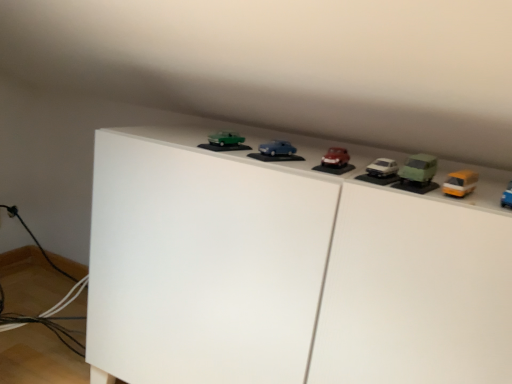
At what (x,y) coordinates should I click in order to perform the action: click on matte blue car at center, the 2th toy from the left. Please return your answer as a coordinate pair (x, y). This screenshot has height=384, width=512. Looking at the image, I should click on (276, 152).

This screenshot has width=512, height=384. What do you see at coordinates (289, 269) in the screenshot? I see `white matte cabinet at upper center` at bounding box center [289, 269].

Describe the element at coordinates (418, 174) in the screenshot. I see `green matte car at right, marked as the 4th toy in a left-to-right arrangement` at that location.

Locate an element on the screen. matte red car at center, marked as the 3th toy in a right-to-left arrangement is located at coordinates (335, 162).

Consider the image. In order to face green matte car at upper center, the fifth toy positioned from the right, should I rotate leftwards or rightwards?

Turn left by 4.174 degrees to look at green matte car at upper center, the fifth toy positioned from the right.

At what (x,y) coordinates should I click in order to perform the action: click on yellow matte van at upper right, the first toy from the right. Please return your answer as a coordinate pair (x, y). Looking at the image, I should click on (460, 183).

How many degrees apart are the facing directions of matte blue car at center, which is the 4th toy in right-to-left order, and white matte cabinet at upper center?

23.6 degrees separate the facing orientations of matte blue car at center, which is the 4th toy in right-to-left order, and white matte cabinet at upper center.

Considering the sizes of objects matte blue car at center, which is the 4th toy in right-to-left order, and white matte cabinet at upper center in the image provided, who is shorter, matte blue car at center, which is the 4th toy in right-to-left order, or white matte cabinet at upper center?

Standing shorter between the two is matte blue car at center, which is the 4th toy in right-to-left order.

Is matte blue car at center, the 2th toy from the left, next to white matte cabinet at upper center and touching it?

No.

Which is more to the right, matte blue car at center, which is the 4th toy in right-to-left order, or white matte cabinet at upper center?

From the viewer's perspective, white matte cabinet at upper center appears more on the right side.

Is yellow matte van at upper right, the fifth toy viewed from the left, smaller than green matte car at right, placed as the second toy when sorted from right to left?

Indeed, yellow matte van at upper right, the fifth toy viewed from the left, has a smaller size compared to green matte car at right, placed as the second toy when sorted from right to left.

How different are the orientations of yellow matte van at upper right, the fifth toy viewed from the left, and green matte car at right, marked as the 4th toy in a left-to-right arrangement, in degrees?

The angle between the facing direction of yellow matte van at upper right, the fifth toy viewed from the left, and the facing direction of green matte car at right, marked as the 4th toy in a left-to-right arrangement, is 1.58 degrees.

From the picture: From a real-world perspective, is yellow matte van at upper right, the fifth toy viewed from the left, above or below green matte car at right, marked as the 4th toy in a left-to-right arrangement?

yellow matte van at upper right, the fifth toy viewed from the left, is situated lower than green matte car at right, marked as the 4th toy in a left-to-right arrangement, in the real world.

The height and width of the screenshot is (384, 512). In order to click on the 1st toy behind the yellow matte van at upper right, the first toy from the right in this screenshot , I will do `click(418, 174)`.

Which is more distant, (x=477, y=250) or (x=425, y=191)?

The point (x=425, y=191) is more distant.

From the image's perspective, is white matte cabinet at upper center under green matte car at right, placed as the second toy when sorted from right to left?

Yes.

From the picture: Between white matte cabinet at upper center and green matte car at right, placed as the second toy when sorted from right to left, which one has larger width?

white matte cabinet at upper center is wider.

From a real-world perspective, is white matte cabinet at upper center above or below green matte car at upper center, which ranks as the 1th toy in left-to-right order?

From a real-world perspective, white matte cabinet at upper center is physically below green matte car at upper center, which ranks as the 1th toy in left-to-right order.

Is white matte cabinet at upper center aimed at green matte car at upper center, which ranks as the 1th toy in left-to-right order?

No, white matte cabinet at upper center is not facing towards green matte car at upper center, which ranks as the 1th toy in left-to-right order.

Between white matte cabinet at upper center and green matte car at upper center, the fifth toy positioned from the right, which one has smaller size?

With smaller size is green matte car at upper center, the fifth toy positioned from the right.

In terms of width, does green matte car at right, marked as the 4th toy in a left-to-right arrangement, look wider or thinner when compared to yellow matte van at upper right, the fifth toy viewed from the left?

In the image, green matte car at right, marked as the 4th toy in a left-to-right arrangement, appears to be more narrow than yellow matte van at upper right, the fifth toy viewed from the left.

Is green matte car at right, placed as the second toy when sorted from right to left, situated inside yellow matte van at upper right, the first toy from the right, or outside?

green matte car at right, placed as the second toy when sorted from right to left, is not enclosed by yellow matte van at upper right, the first toy from the right.

Is green matte car at right, marked as the 4th toy in a left-to-right arrangement, bigger or smaller than yellow matte van at upper right, the fifth toy viewed from the left?

green matte car at right, marked as the 4th toy in a left-to-right arrangement, is bigger than yellow matte van at upper right, the fifth toy viewed from the left.

Does green matte car at upper center, the fifth toy positioned from the right, lie in front of yellow matte van at upper right, the first toy from the right?

No, the depth of green matte car at upper center, the fifth toy positioned from the right, is greater than that of yellow matte van at upper right, the first toy from the right.

From the image's perspective, is green matte car at upper center, which ranks as the 1th toy in left-to-right order, below yellow matte van at upper right, the fifth toy viewed from the left?

Incorrect, from the image's perspective, green matte car at upper center, which ranks as the 1th toy in left-to-right order, is higher than yellow matte van at upper right, the fifth toy viewed from the left.

Does point (242, 148) lie in front of point (462, 174)?

No, it is not.

Do you think green matte car at upper center, which ranks as the 1th toy in left-to-right order, is within yellow matte van at upper right, the fifth toy viewed from the left, or outside of it?

green matte car at upper center, which ranks as the 1th toy in left-to-right order, is spatially situated outside yellow matte van at upper right, the fifth toy viewed from the left.

Based on the photo, between green matte car at upper center, the fifth toy positioned from the right, and white matte cabinet at upper center, which one has larger width?

white matte cabinet at upper center is wider.

Measure the distance between green matte car at upper center, the fifth toy positioned from the right, and white matte cabinet at upper center.

green matte car at upper center, the fifth toy positioned from the right, and white matte cabinet at upper center are 13.31 inches apart.

Is green matte car at upper center, the fifth toy positioned from the right, inside or outside of white matte cabinet at upper center?

green matte car at upper center, the fifth toy positioned from the right, exists outside the volume of white matte cabinet at upper center.

Between green matte car at upper center, which ranks as the 1th toy in left-to-right order, and white matte cabinet at upper center, which one appears on the left side from the viewer's perspective?

From the viewer's perspective, green matte car at upper center, which ranks as the 1th toy in left-to-right order, appears more on the left side.

At what (x,y) coordinates should I click in order to perform the action: click on furniture below the matte blue car at center, the 2th toy from the left (from a real-world perspective). Please return your answer as a coordinate pair (x, y). The height and width of the screenshot is (384, 512). Looking at the image, I should click on (289, 269).

From the image's perspective, starting from the yellow matte van at upper right, the fifth toy viewed from the left, which toy is the 1st one above? Please provide its 2D coordinates.

[(418, 174)]

From the image, which object appears to be nearer to yellow matte van at upper right, the first toy from the right, green matte car at upper center, the fifth toy positioned from the right, or matte red car at center, arranged as the 3th toy when viewed from the left?

matte red car at center, arranged as the 3th toy when viewed from the left.

Which object lies nearer to the anchor point matte blue car at center, the 2th toy from the left, green matte car at right, marked as the 4th toy in a left-to-right arrangement, or white matte cabinet at upper center?

The object closer to matte blue car at center, the 2th toy from the left, is green matte car at right, marked as the 4th toy in a left-to-right arrangement.

Which object lies further to the anchor point green matte car at upper center, which ranks as the 1th toy in left-to-right order, green matte car at right, placed as the second toy when sorted from right to left, or matte red car at center, arranged as the 3th toy when viewed from the left?

green matte car at right, placed as the second toy when sorted from right to left, is further to green matte car at upper center, which ranks as the 1th toy in left-to-right order.

Looking at the image, which one is located further to matte blue car at center, the 2th toy from the left, white matte cabinet at upper center or matte red car at center, marked as the 3th toy in a right-to-left arrangement?

white matte cabinet at upper center lies further to matte blue car at center, the 2th toy from the left, than the other object.

From the image, which object appears to be farther from yellow matte van at upper right, the first toy from the right, white matte cabinet at upper center or green matte car at upper center, the fifth toy positioned from the right?

white matte cabinet at upper center is further to yellow matte van at upper right, the first toy from the right.

Based on their spatial positions, is yellow matte van at upper right, the first toy from the right, or matte red car at center, marked as the 3th toy in a right-to-left arrangement, further from matte blue car at center, which is the 4th toy in right-to-left order?

yellow matte van at upper right, the first toy from the right, lies further to matte blue car at center, which is the 4th toy in right-to-left order, than the other object.

From the image, which object appears to be nearer to matte red car at center, arranged as the 3th toy when viewed from the left, white matte cabinet at upper center or yellow matte van at upper right, the first toy from the right?

yellow matte van at upper right, the first toy from the right, lies closer to matte red car at center, arranged as the 3th toy when viewed from the left, than the other object.

When comparing their distances from white matte cabinet at upper center, does green matte car at right, placed as the second toy when sorted from right to left, or yellow matte van at upper right, the fifth toy viewed from the left, seem closer?

green matte car at right, placed as the second toy when sorted from right to left, is positioned closer to the anchor white matte cabinet at upper center.

Locate an element on the screen. This screenshot has height=384, width=512. toy that lies between green matte car at right, marked as the 4th toy in a left-to-right arrangement, and white matte cabinet at upper center from top to bottom is located at coordinates (460, 183).

Locate an element on the screen. furniture between green matte car at upper center, the fifth toy positioned from the right, and yellow matte van at upper right, the first toy from the right is located at coordinates click(289, 269).

Locate an element on the screen. This screenshot has height=384, width=512. toy situated between matte blue car at center, the 2th toy from the left, and green matte car at right, marked as the 4th toy in a left-to-right arrangement, from left to right is located at coordinates (335, 162).

Find the location of a particular element. This screenshot has width=512, height=384. toy between matte red car at center, arranged as the 3th toy when viewed from the left, and yellow matte van at upper right, the fifth toy viewed from the left, in the horizontal direction is located at coordinates (418, 174).